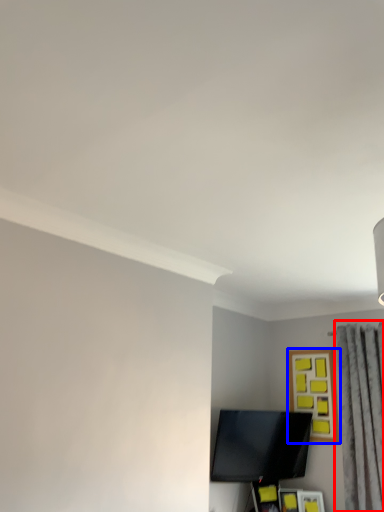
Question: Which object is further to the camera taking this photo, curtain (highlighted by a red box) or picture frame (highlighted by a blue box)?

Choices:
 (A) curtain
 (B) picture frame

Answer: (B)